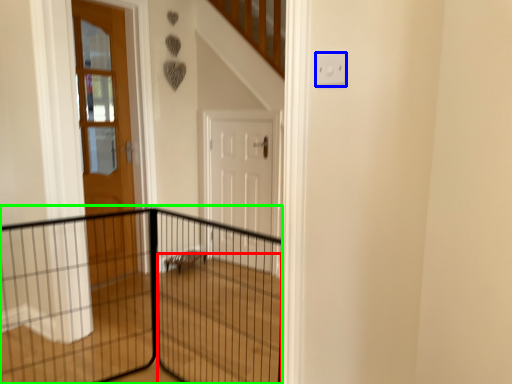
Question: Considering the real-world distances, which object is closest to stairwell (highlighted by a red box)? electric outlet (highlighted by a blue box) or fence (highlighted by a green box).

Choices:
 (A) electric outlet
 (B) fence

Answer: (B)